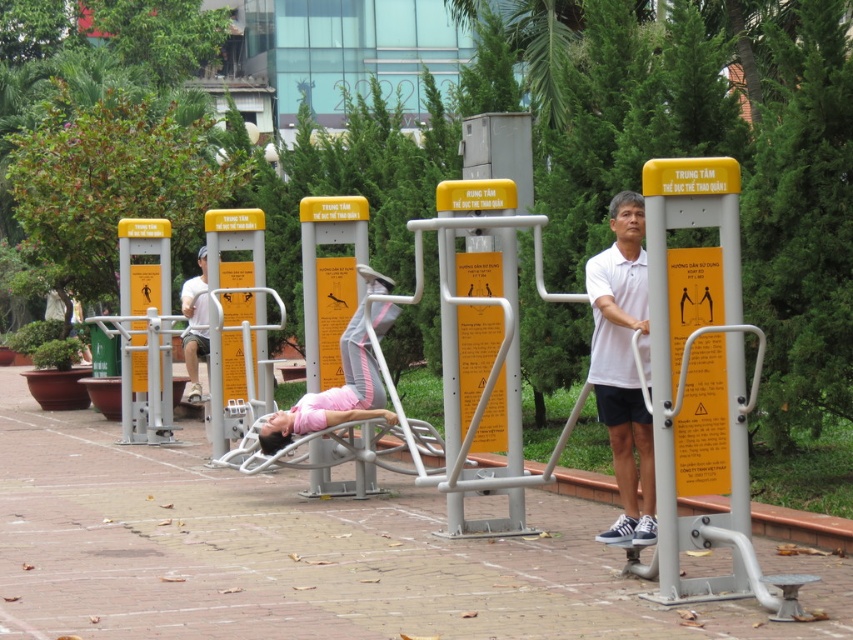
Question: In this image, where is matte yellow pole at center located relative to matte white shirt at center?

Choices:
 (A) left
 (B) right

Answer: (B)

Question: Can you confirm if white matte shirt at center is bigger than matte yellow pole at center?

Choices:
 (A) no
 (B) yes

Answer: (B)

Question: Can you confirm if matte yellow pole at center is bigger than matte white shirt at center?

Choices:
 (A) yes
 (B) no

Answer: (B)

Question: Considering the real-world distances, which object is farthest from the white matte shirt at center?

Choices:
 (A) matte yellow pole at center
 (B) matte white shirt at center

Answer: (B)

Question: Which of the following is the farthest from the observer?

Choices:
 (A) (212, 419)
 (B) (186, 291)
 (C) (616, 371)

Answer: (B)

Question: Which object is closer to the camera taking this photo?

Choices:
 (A) white matte shirt at center
 (B) matte yellow pole at center
 (C) matte white shirt at center

Answer: (A)